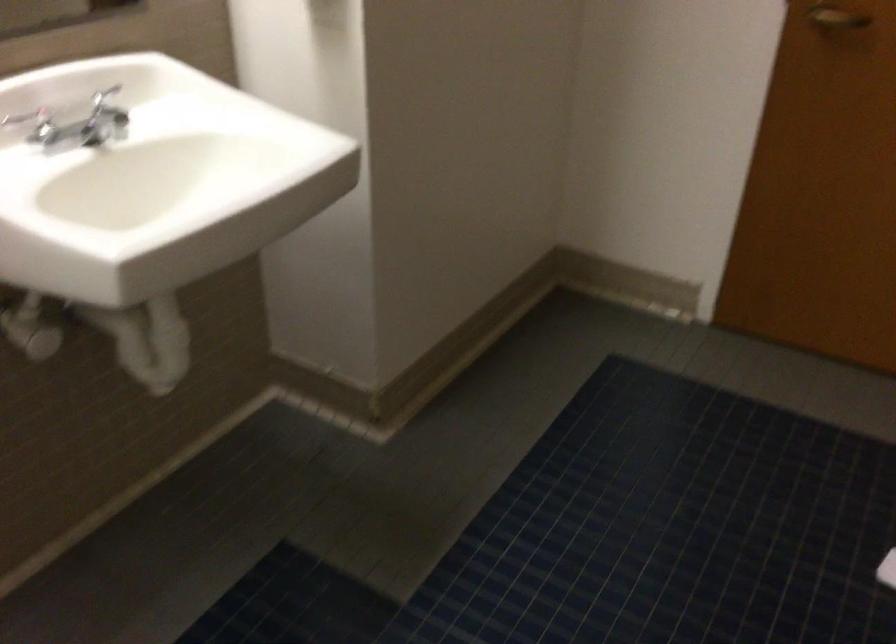
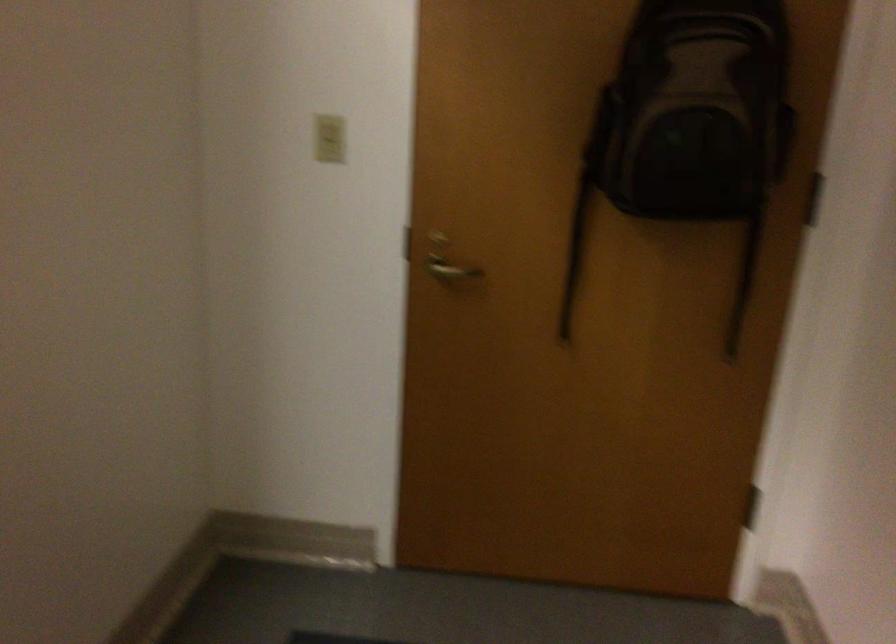
Question: The images are taken continuously from a first-person perspective. In which direction is your viewpoint rotating?

Choices:
 (A) Left
 (B) Right
 (C) Up
 (D) Down

Answer: (B)